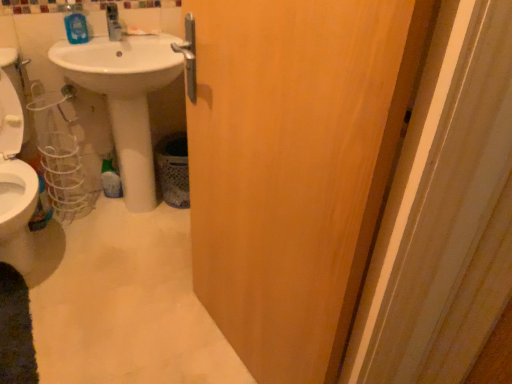
Question: Considering the relative sizes of wooden door at center and blue glossy mouthwash at upper left in the image provided, is wooden door at center bigger than blue glossy mouthwash at upper left?

Choices:
 (A) no
 (B) yes

Answer: (B)

Question: Can you confirm if wooden door at center is shorter than blue glossy mouthwash at upper left?

Choices:
 (A) yes
 (B) no

Answer: (B)

Question: Is wooden door at center in contact with blue glossy mouthwash at upper left?

Choices:
 (A) yes
 (B) no

Answer: (B)

Question: Is wooden door at center thinner than blue glossy mouthwash at upper left?

Choices:
 (A) yes
 (B) no

Answer: (B)

Question: Is wooden door at center facing towards blue glossy mouthwash at upper left?

Choices:
 (A) yes
 (B) no

Answer: (B)

Question: Is point (343, 0) positioned closer to the camera than point (138, 208)?

Choices:
 (A) farther
 (B) closer

Answer: (B)

Question: Considering the positions of wooden door at center and white glossy sink at center in the image, is wooden door at center wider or thinner than white glossy sink at center?

Choices:
 (A) wide
 (B) thin

Answer: (B)

Question: Choose the correct answer: Is wooden door at center inside white glossy sink at center or outside it?

Choices:
 (A) inside
 (B) outside

Answer: (B)

Question: In terms of height, does wooden door at center look taller or shorter compared to white glossy sink at center?

Choices:
 (A) tall
 (B) short

Answer: (A)

Question: Relative to wooden door at center, is blue glossy mouthwash at upper left in front or behind?

Choices:
 (A) behind
 (B) front

Answer: (A)

Question: Considering the positions of blue glossy mouthwash at upper left and wooden door at center in the image, is blue glossy mouthwash at upper left bigger or smaller than wooden door at center?

Choices:
 (A) big
 (B) small

Answer: (B)

Question: From a real-world perspective, is blue glossy mouthwash at upper left positioned above or below wooden door at center?

Choices:
 (A) below
 (B) above

Answer: (B)

Question: Is blue glossy mouthwash at upper left taller or shorter than wooden door at center?

Choices:
 (A) short
 (B) tall

Answer: (A)

Question: Looking at their shapes, would you say white glossy sink at center is wider or thinner than wooden door at center?

Choices:
 (A) wide
 (B) thin

Answer: (A)

Question: Is white glossy sink at center to the left or to the right of wooden door at center in the image?

Choices:
 (A) right
 (B) left

Answer: (B)